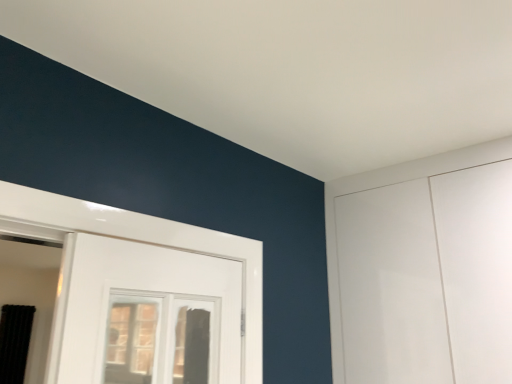
Question: Is black fabric curtain at left behind clear glass window at center?

Choices:
 (A) no
 (B) yes

Answer: (B)

Question: Is clear glass window at center located within black fabric curtain at left?

Choices:
 (A) no
 (B) yes

Answer: (A)

Question: Considering the relative sizes of black fabric curtain at left and clear glass window at center in the image provided, is black fabric curtain at left wider than clear glass window at center?

Choices:
 (A) no
 (B) yes

Answer: (B)

Question: Considering the relative positions of black fabric curtain at left and clear glass window at center in the image provided, is black fabric curtain at left in front of clear glass window at center?

Choices:
 (A) no
 (B) yes

Answer: (A)

Question: From the image's perspective, is black fabric curtain at left located beneath clear glass window at center?

Choices:
 (A) no
 (B) yes

Answer: (B)

Question: From the image's perspective, is black fabric curtain at left located above clear glass window at center?

Choices:
 (A) yes
 (B) no

Answer: (B)

Question: Is clear glass window at center far away from black fabric curtain at left?

Choices:
 (A) no
 (B) yes

Answer: (B)

Question: Would you say black fabric curtain at left is part of clear glass window at center's contents?

Choices:
 (A) yes
 (B) no

Answer: (B)

Question: Does clear glass window at center have a greater width compared to black fabric curtain at left?

Choices:
 (A) yes
 (B) no

Answer: (B)

Question: Is clear glass window at center in front of black fabric curtain at left?

Choices:
 (A) yes
 (B) no

Answer: (A)

Question: Is clear glass window at center bigger than black fabric curtain at left?

Choices:
 (A) yes
 (B) no

Answer: (A)

Question: From a real-world perspective, is clear glass window at center on black fabric curtain at left?

Choices:
 (A) no
 (B) yes

Answer: (B)

Question: In terms of size, does black fabric curtain at left appear bigger or smaller than clear glass window at center?

Choices:
 (A) small
 (B) big

Answer: (A)